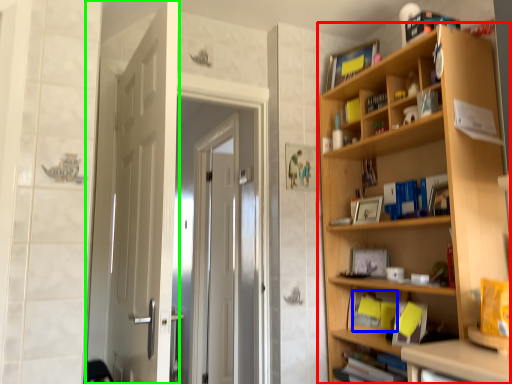
Question: Which object is positioned farthest from bookcase (highlighted by a red box)? Select from book (highlighted by a blue box) and door (highlighted by a green box).

Choices:
 (A) book
 (B) door

Answer: (B)